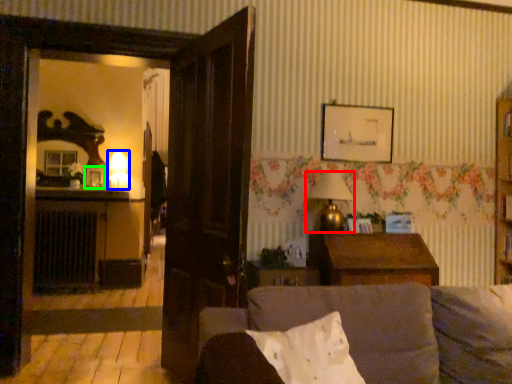
Question: Considering the real-world distances, which object is closest to lamp (highlighted by a red box)? lamp (highlighted by a blue box) or picture frame (highlighted by a green box).

Choices:
 (A) lamp
 (B) picture frame

Answer: (B)